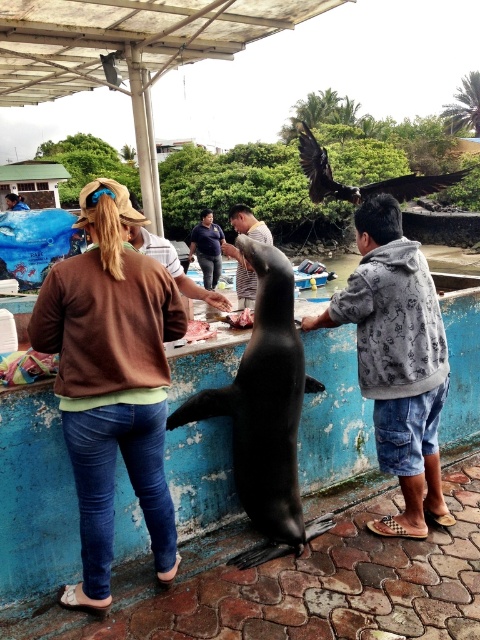
Question: Can you confirm if striped shirt at center is positioned below brown leather hat at upper left?

Choices:
 (A) yes
 (B) no

Answer: (A)

Question: Which object is positioned farthest from the dark blue shirt at center?

Choices:
 (A) brown leather hat at upper left
 (B) smooth pinkish-red fish at center
 (C) striped shirt at center
 (D) black smooth seal at center

Answer: (A)

Question: Which point appears closest to the camera in this image?

Choices:
 (A) (204, 324)
 (B) (384, 326)
 (C) (108, 500)
 (D) (226, 320)

Answer: (C)

Question: Does brown cotton sweater at upper left come behind dark blue jeans at center?

Choices:
 (A) no
 (B) yes

Answer: (A)

Question: Estimate the real-world distances between objects in this image. Which object is closer to the brown cotton sweater at upper left?

Choices:
 (A) raw meat at center
 (B) dark blue shirt at center
 (C) gray printed hoodie at center

Answer: (C)

Question: Does striped shirt at center lie in front of brown leather hat at upper left?

Choices:
 (A) no
 (B) yes

Answer: (B)